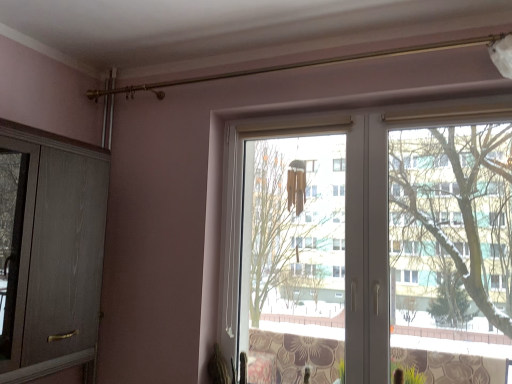
Question: Are matte wood screen door at left and white plastic window at center far apart?

Choices:
 (A) no
 (B) yes

Answer: (A)

Question: Is matte wood screen door at left facing away from white plastic window at center?

Choices:
 (A) no
 (B) yes

Answer: (A)

Question: Is matte wood screen door at left positioned behind white plastic window at center?

Choices:
 (A) no
 (B) yes

Answer: (A)

Question: From the image's perspective, is matte wood screen door at left under white plastic window at center?

Choices:
 (A) yes
 (B) no

Answer: (B)

Question: From a real-world perspective, is matte wood screen door at left physically below white plastic window at center?

Choices:
 (A) no
 (B) yes

Answer: (B)

Question: Is matte wood screen door at left to the left of white plastic window at center from the viewer's perspective?

Choices:
 (A) no
 (B) yes

Answer: (B)

Question: From the image's perspective, does white plastic window at center appear higher than matte wood screen door at left?

Choices:
 (A) yes
 (B) no

Answer: (B)

Question: From the image's perspective, is white plastic window at center below matte wood screen door at left?

Choices:
 (A) no
 (B) yes

Answer: (B)

Question: From a real-world perspective, is white plastic window at center beneath matte wood screen door at left?

Choices:
 (A) no
 (B) yes

Answer: (A)

Question: Can you confirm if white plastic window at center is wider than matte wood screen door at left?

Choices:
 (A) yes
 (B) no

Answer: (B)

Question: Considering the relative sizes of white plastic window at center and matte wood screen door at left in the image provided, is white plastic window at center bigger than matte wood screen door at left?

Choices:
 (A) yes
 (B) no

Answer: (B)

Question: Is matte wood screen door at left inside white plastic window at center?

Choices:
 (A) no
 (B) yes

Answer: (A)

Question: From the image's perspective, is matte wood screen door at left positioned above or below white plastic window at center?

Choices:
 (A) below
 (B) above

Answer: (B)